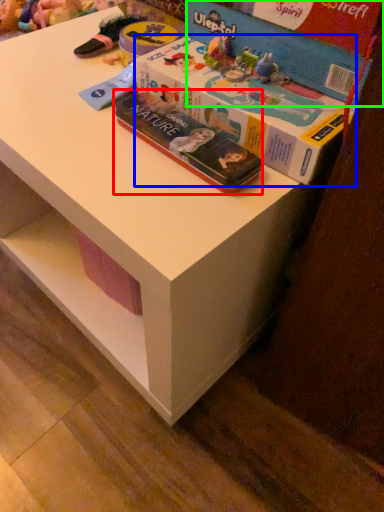
Question: Which is farther away from book (highlighted by a red box)? box (highlighted by a blue box) or box (highlighted by a green box)?

Choices:
 (A) box
 (B) box

Answer: (B)